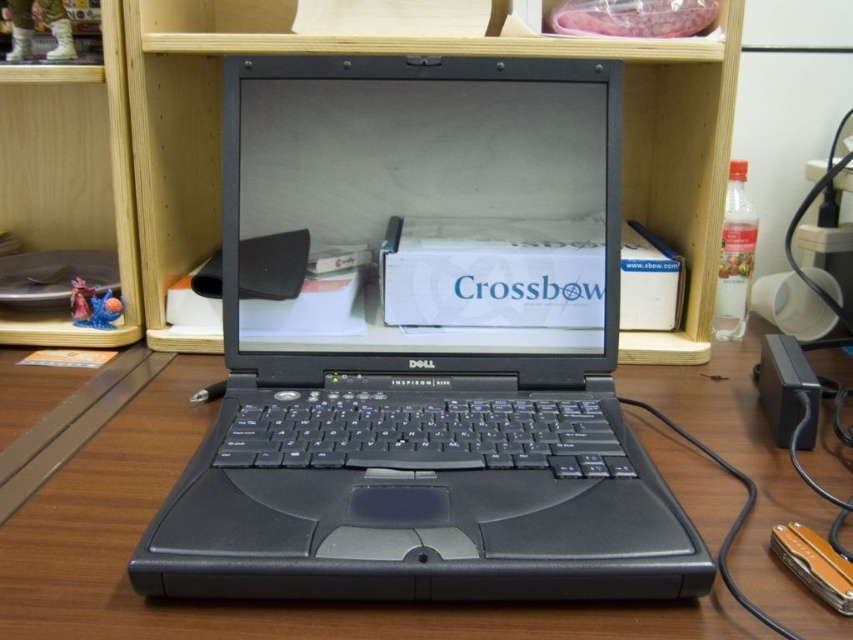
Can you confirm if wooden bookshelf at upper left is bigger than black rubber mouse at center?

Yes.

Is wooden bookshelf at upper left further to the viewer compared to black rubber mouse at center?

Yes, it is behind black rubber mouse at center.

Which is behind, point (51, 337) or point (363, 544)?

The point (51, 337) is behind.

I want to click on wooden bookshelf at upper left, so click(70, 179).

Is wooden table at center thinner than wooden bookshelf at center?

No, wooden table at center is not thinner than wooden bookshelf at center.

Describe the element at coordinates (245, 602) in the screenshot. I see `wooden table at center` at that location.

In order to click on wooden table at center in this screenshot , I will do `click(245, 602)`.

Which is below, wooden bookshelf at center or wooden bookshelf at upper left?

wooden bookshelf at upper left is lower down.

Where is `wooden bookshelf at center`? The image size is (853, 640). wooden bookshelf at center is located at coordinates (418, 52).

This screenshot has height=640, width=853. Find the location of `wooden bookshelf at center`. wooden bookshelf at center is located at coordinates (418, 52).